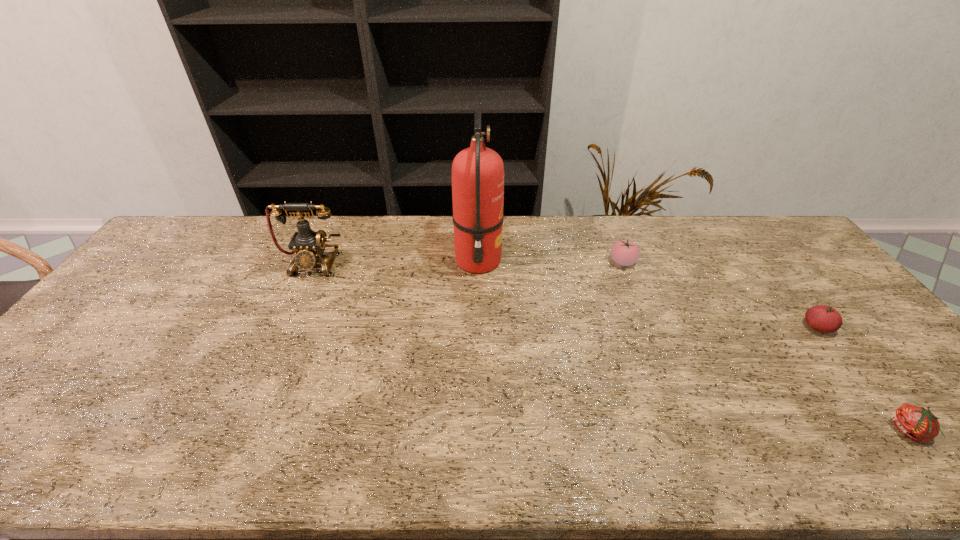
In order to click on fire extinguisher in this screenshot , I will do `click(477, 172)`.

I want to click on the second object from left to right, so click(477, 172).

Where is `the leftmost object`? The width and height of the screenshot is (960, 540). the leftmost object is located at coordinates (309, 246).

Image resolution: width=960 pixels, height=540 pixels. I want to click on the fourth shortest object, so click(309, 246).

This screenshot has width=960, height=540. Find the location of `the farthest tomato`. the farthest tomato is located at coordinates (624, 252).

Identify the location of the leftmost tomato. The height and width of the screenshot is (540, 960). (624, 252).

You are a GUI agent. You are given a task and a screenshot of the screen. Output one action in this format:
    pyautogui.click(x=<x>, y=<y>)
    Task: Click on the second nearest tomato
    
    Given the screenshot: What is the action you would take?
    pyautogui.click(x=823, y=318)

What are the coordinates of `the shortest tomato` in the screenshot? It's located at (917, 423).

Identify the location of the nearest object. Image resolution: width=960 pixels, height=540 pixels. (917, 423).

Identify the location of vacant region located on the side of the tallest object with the nozzle and handle. Image resolution: width=960 pixels, height=540 pixels. (520, 261).